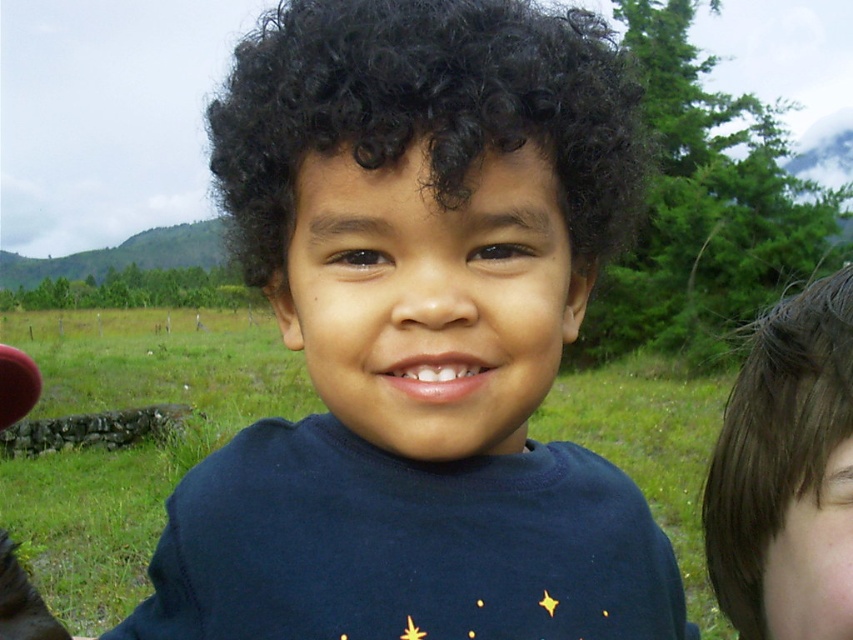
Question: Which object appears closest to the camera in this image?

Choices:
 (A) brown shiny hair at right
 (B) black curly hair at center
 (C) dark blue t-shirt at center

Answer: (C)

Question: Which point appears closest to the camera in this image?

Choices:
 (A) (247, 179)
 (B) (260, 188)

Answer: (B)

Question: Does black curly hair at center appear on the left side of brown shiny hair at right?

Choices:
 (A) yes
 (B) no

Answer: (A)

Question: Can you confirm if black curly hair at center is bigger than brown shiny hair at right?

Choices:
 (A) no
 (B) yes

Answer: (B)

Question: Which object is farther from the camera taking this photo?

Choices:
 (A) brown shiny hair at right
 (B) black curly hair at center
 (C) dark blue t-shirt at center

Answer: (B)

Question: Can you confirm if black curly hair at center is positioned below brown shiny hair at right?

Choices:
 (A) no
 (B) yes

Answer: (A)